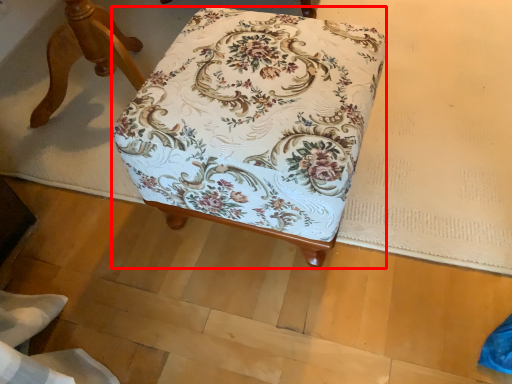
Question: From the image's perspective, considering the relative positions of furniture (annotated by the red box) and furniture in the image provided, where is furniture (annotated by the red box) located with respect to the staircase?

Choices:
 (A) below
 (B) above

Answer: (A)